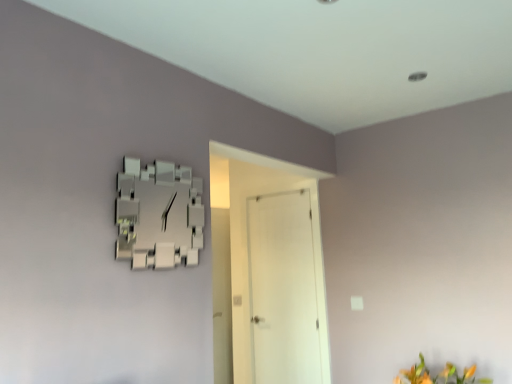
What do you see at coordinates (246, 234) in the screenshot?
I see `white matte door at center` at bounding box center [246, 234].

The image size is (512, 384). In order to click on white matte door at center in this screenshot , I will do `click(246, 234)`.

This screenshot has height=384, width=512. Describe the element at coordinates (438, 375) in the screenshot. I see `orange matte flower at lower right` at that location.

Locate an element on the screen. This screenshot has height=384, width=512. orange matte flower at lower right is located at coordinates (438, 375).

Where is `white matte door at center`? The height and width of the screenshot is (384, 512). white matte door at center is located at coordinates (246, 234).

Considering the relative positions of orange matte flower at lower right and white matte door at center in the image provided, is orange matte flower at lower right to the right of white matte door at center from the viewer's perspective?

Yes, orange matte flower at lower right is to the right of white matte door at center.

Is the position of orange matte flower at lower right more distant than that of white matte door at center?

No, orange matte flower at lower right is closer to the viewer.

Does point (443, 380) come behind point (222, 188)?

No, it is not.

From the image's perspective, relative to white matte door at center, is orange matte flower at lower right above or below?

Based on their image positions, orange matte flower at lower right is located beneath white matte door at center.

From a real-world perspective, between orange matte flower at lower right and white matte door at center, who is vertically lower?

orange matte flower at lower right.

Does orange matte flower at lower right have a lesser width compared to white matte door at center?

In fact, orange matte flower at lower right might be wider than white matte door at center.

Considering the relative sizes of orange matte flower at lower right and white matte door at center in the image provided, is orange matte flower at lower right shorter than white matte door at center?

Correct, orange matte flower at lower right is not as tall as white matte door at center.

Is orange matte flower at lower right bigger than white matte door at center?

No, orange matte flower at lower right is not bigger than white matte door at center.

Is orange matte flower at lower right surrounding white matte door at center?

Actually, white matte door at center is outside orange matte flower at lower right.

Are orange matte flower at lower right and white matte door at center beside each other?

There is a gap between orange matte flower at lower right and white matte door at center.

Is orange matte flower at lower right oriented towards white matte door at center?

No, orange matte flower at lower right does not turn towards white matte door at center.

This screenshot has width=512, height=384. Identify the location of flower in front of the white matte door at center. (438, 375).

Does white matte door at center appear on the right side of orange matte flower at lower right?

Incorrect, white matte door at center is not on the right side of orange matte flower at lower right.

Considering the positions of objects white matte door at center and orange matte flower at lower right in the image provided, who is in front, white matte door at center or orange matte flower at lower right?

orange matte flower at lower right.

Between point (210, 180) and point (424, 370), which one is positioned behind?

Point (210, 180)

From the image's perspective, is white matte door at center positioned above or below orange matte flower at lower right?

Based on their image positions, white matte door at center is located above orange matte flower at lower right.

From a real-world perspective, is white matte door at center positioned above or below orange matte flower at lower right?

In terms of real-world spatial position, white matte door at center is above orange matte flower at lower right.

Considering the sizes of white matte door at center and orange matte flower at lower right in the image, is white matte door at center wider or thinner than orange matte flower at lower right?

white matte door at center is thinner than orange matte flower at lower right.

Can you confirm if white matte door at center is taller than orange matte flower at lower right?

Yes, white matte door at center is taller than orange matte flower at lower right.

Is white matte door at center bigger than orange matte flower at lower right?

Correct, white matte door at center is larger in size than orange matte flower at lower right.

Is white matte door at center spatially inside orange matte flower at lower right, or outside of it?

white matte door at center is not inside orange matte flower at lower right, it's outside.

Are white matte door at center and orange matte flower at lower right far apart?

Absolutely, white matte door at center is distant from orange matte flower at lower right.

Is white matte door at center facing away from orange matte flower at lower right?

That's not correct — white matte door at center is not looking away from orange matte flower at lower right.

At what (x,y) coordinates should I click in order to perform the action: click on flower in front of the white matte door at center. Please return your answer as a coordinate pair (x, y). The height and width of the screenshot is (384, 512). Looking at the image, I should click on tap(438, 375).

Locate an element on the screen. flower below the white matte door at center (from a real-world perspective) is located at coordinates (438, 375).

In order to click on flower in front of the white matte door at center in this screenshot , I will do [x=438, y=375].